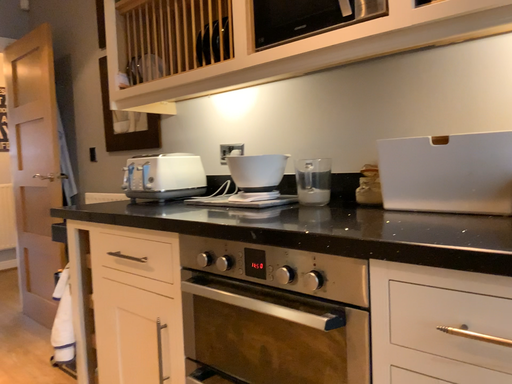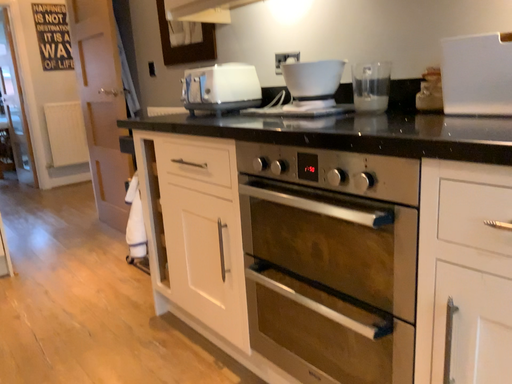
Question: How did the camera likely rotate when shooting the video?

Choices:
 (A) rotated upward
 (B) rotated downward

Answer: (B)